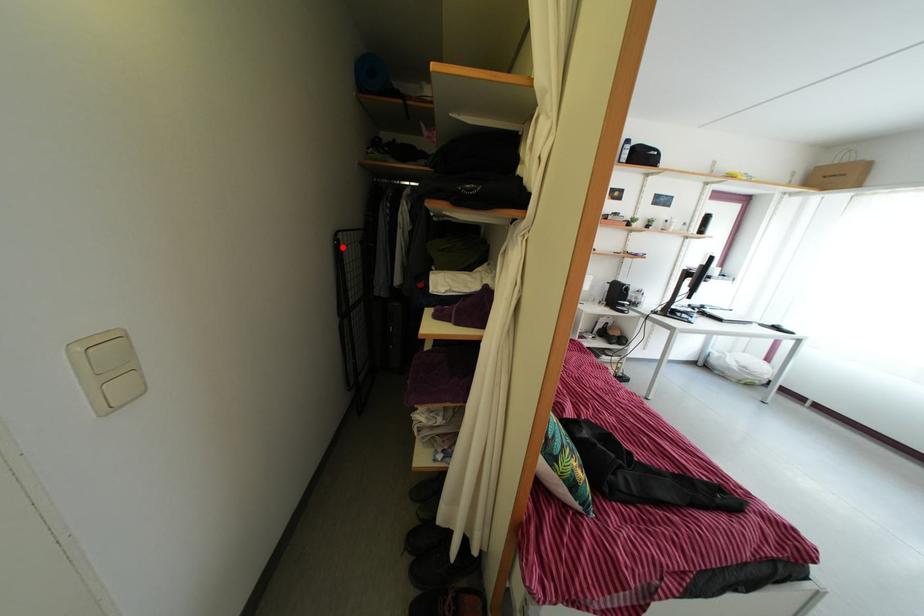
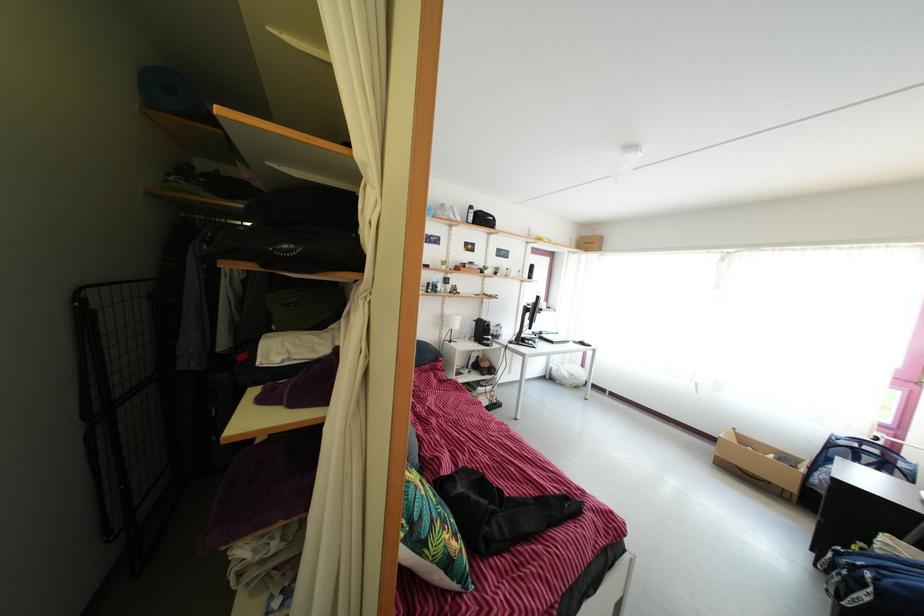
Question: I am providing you with two images of the same scene from different viewpoints. A red point is marked on the first image. Can you still see the location of the red point in image 2?

Choices:
 (A) Yes
 (B) No

Answer: (A)